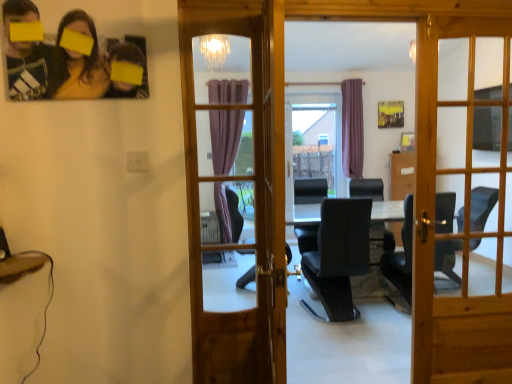
Question: Based on their sizes in the image, would you say wooden door at center, which ranks as the 2th door in left-to-right order, is bigger or smaller than black leather chair at center?

Choices:
 (A) small
 (B) big

Answer: (A)

Question: Is point (415, 357) closer or farther from the camera than point (371, 235)?

Choices:
 (A) farther
 (B) closer

Answer: (B)

Question: Which of these objects is positioned closest to the wooden door at center, marked as the 1th door in a right-to-left arrangement?

Choices:
 (A) black leather chair at center
 (B) matte black photo frame at upper left
 (C) wooden door at center, the 1th door from the left

Answer: (B)

Question: Considering the real-world distances, which object is farthest from the matte black photo frame at upper left?

Choices:
 (A) wooden door at center, which ranks as the 2th door in left-to-right order
 (B) black leather chair at center
 (C) wooden door at center, the 1th door from the left

Answer: (C)